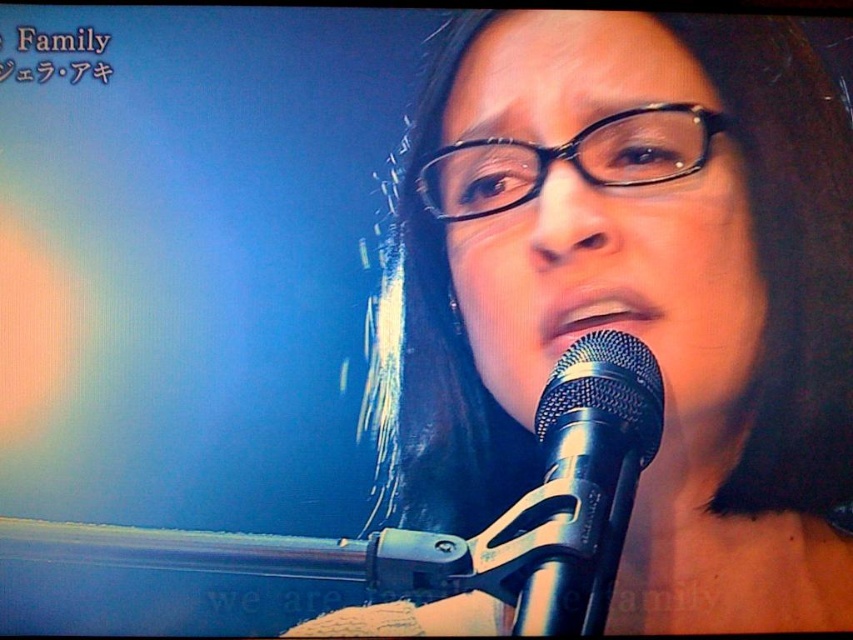
You are a stagehand who needs to adjust the microphone stand so that the performer can reach the matte black microphone at center comfortably. The performer is 1.7 meters tall. What adjustment should you make to the microphone stand?

The matte black microphone at center is currently 1.34 meters away from the viewer. Since the performer is 1.7 meters tall, the microphone stand should be lowered so that the microphone is positioned at a comfortable height for the performer to reach without straining.

You are a photographer trying to capture a close shot of the singer. You need to focus on both the black metallic microphone at lower center and the black plastic glasses at center. Which object should you adjust your camera to focus on first if you want to ensure both are in frame?

The black metallic microphone at lower center is to the left of black plastic glasses at center. Since the glasses are at the center, you should focus on the black plastic glasses at center first to ensure both are in frame.

Based on the photo, you are a sound technician adjusting the microphone stand. The black metallic microphone at lower center needs to be positioned so that it is exactly 50 centimeters away from the black plastic glasses at center. Currently, the distance between them is 40.65 centimeters. Should you move the microphone closer or farther away from the glasses?

The current distance between the black metallic microphone at lower center and the black plastic glasses at center is 40.65 centimeters. To reach the desired 50 centimeters, you should move the microphone farther away from the glasses.